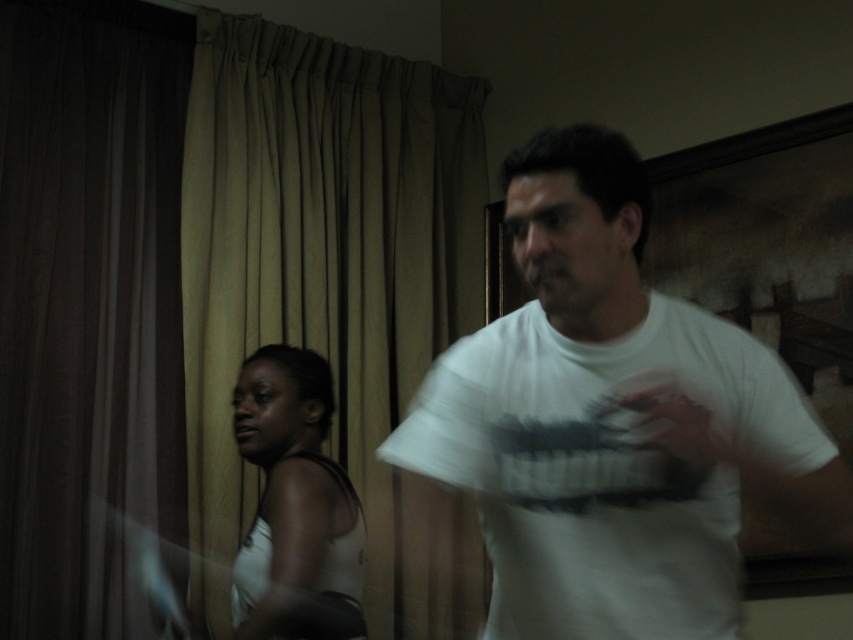
Who is taller, white matte t-shirt at center or beige fabric curtain at upper center?

With more height is beige fabric curtain at upper center.

Can you confirm if white matte t-shirt at center is positioned to the right of beige fabric curtain at upper center?

Yes, white matte t-shirt at center is to the right of beige fabric curtain at upper center.

Where is `white matte t-shirt at center`? The width and height of the screenshot is (853, 640). white matte t-shirt at center is located at coordinates (608, 424).

Can you confirm if white matte t-shirt at center is positioned below white matte tank top at left?

No, white matte t-shirt at center is not below white matte tank top at left.

Where is `white matte t-shirt at center`? The height and width of the screenshot is (640, 853). white matte t-shirt at center is located at coordinates (608, 424).

Is beige fabric curtain at upper center smaller than white matte tank top at left?

Incorrect, beige fabric curtain at upper center is not smaller in size than white matte tank top at left.

Who is positioned more to the left, beige fabric curtain at upper center or white matte tank top at left?

white matte tank top at left is more to the left.

The width and height of the screenshot is (853, 640). What do you see at coordinates (328, 276) in the screenshot?
I see `beige fabric curtain at upper center` at bounding box center [328, 276].

This screenshot has width=853, height=640. In order to click on beige fabric curtain at upper center in this screenshot , I will do `click(328, 276)`.